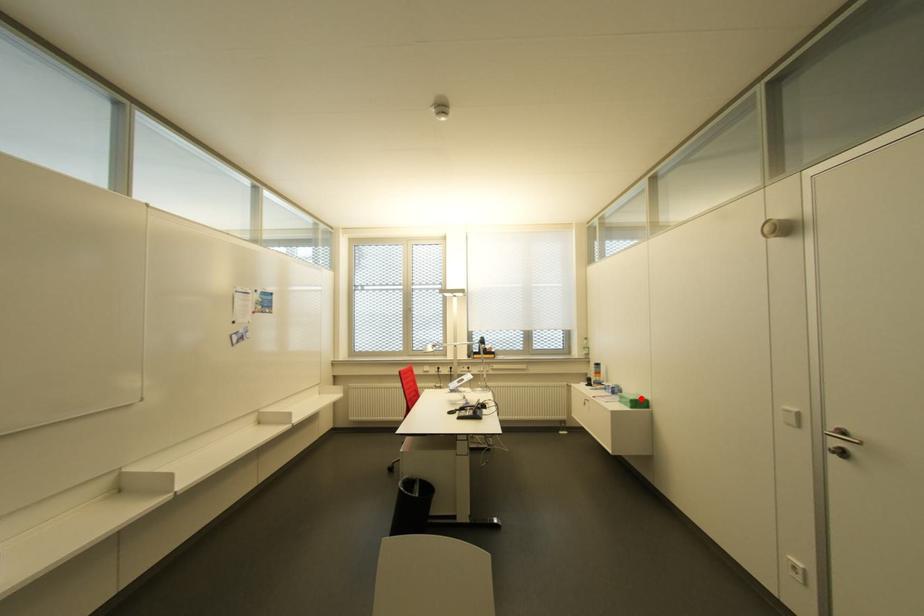
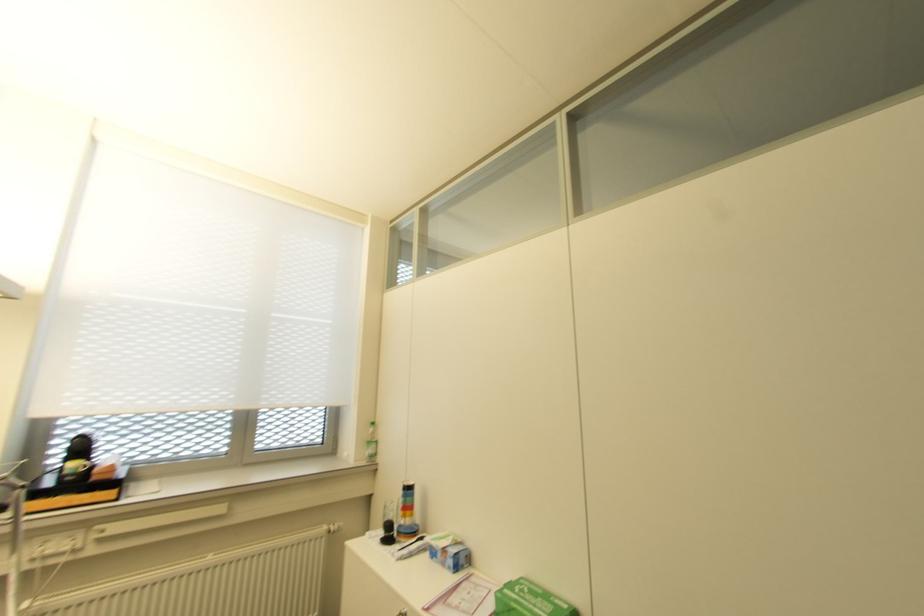
Question: I am providing you with two images of the same scene from different viewpoints. A red point is marked on the first image. Can you still see the location of the red point in image 2?

Choices:
 (A) Yes
 (B) No

Answer: (A)